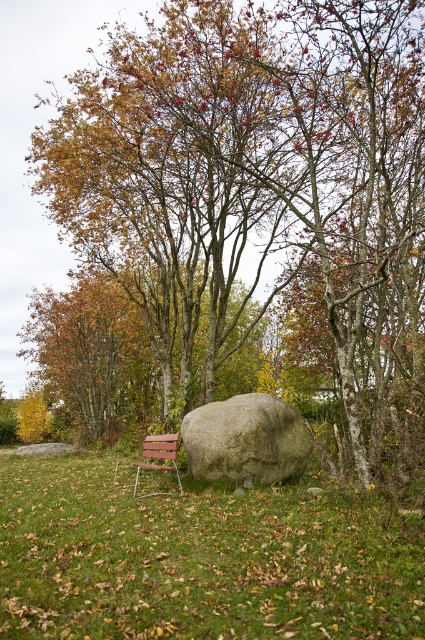
Which of these two, brown textured rock at center or wooden park bench at lower left, stands shorter?

Standing shorter between the two is wooden park bench at lower left.

Who is positioned more to the right, brown textured rock at center or wooden park bench at lower left?

brown textured rock at center

Is point (269, 188) positioned behind point (159, 440)?

No, (269, 188) is closer to viewer.

At what (x,y) coordinates should I click in order to perform the action: click on brown textured rock at center. Please return your answer as a coordinate pair (x, y). Looking at the image, I should click on (261, 195).

Is green grassy at center below gray rough boulder at center?

Yes, green grassy at center is below gray rough boulder at center.

Is green grassy at center thinner than gray rough boulder at center?

Yes.

Does point (39, 595) lie in front of point (265, 481)?

Yes, point (39, 595) is in front of point (265, 481).

The image size is (425, 640). I want to click on green grassy at center, so click(x=200, y=560).

Consider the image. Does green grassy at center have a greater height compared to wooden park bench at lower left?

Incorrect, green grassy at center's height is not larger of wooden park bench at lower left's.

Between green grassy at center and wooden park bench at lower left, which one has more height?

wooden park bench at lower left is taller.

Does point (314, 618) lie in front of point (150, 472)?

Yes, point (314, 618) is in front of point (150, 472).

Locate an element on the screen. This screenshot has width=425, height=640. green grassy at center is located at coordinates (x=200, y=560).